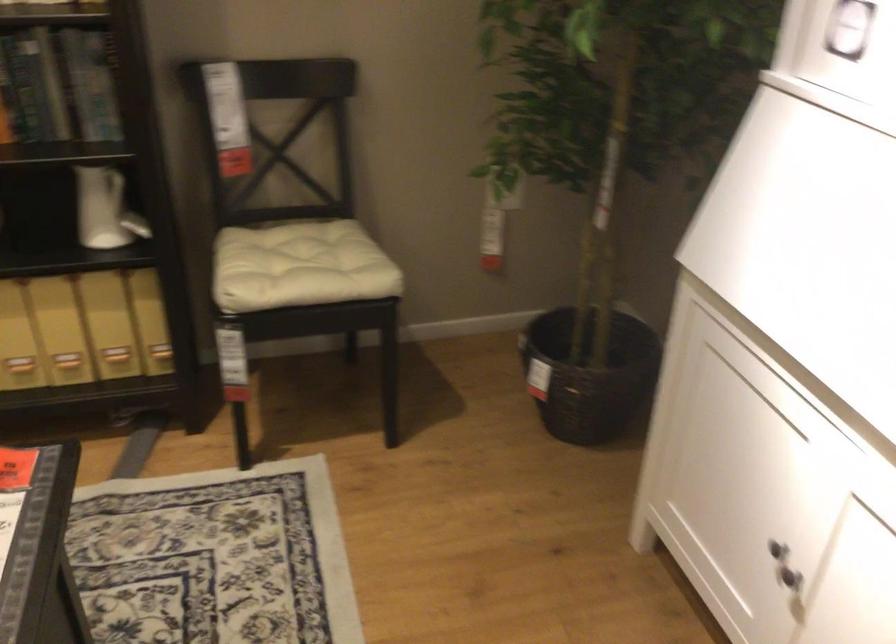
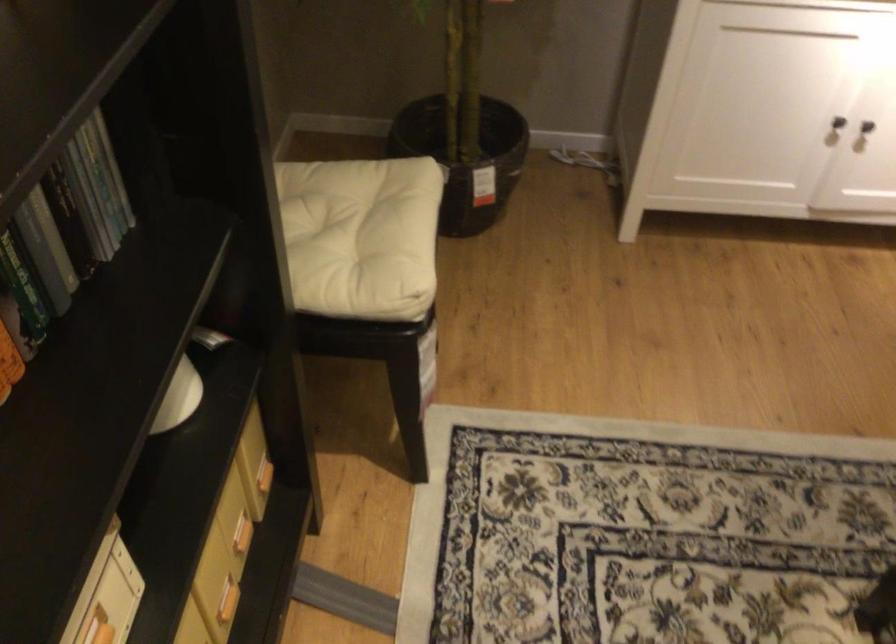
The point at (74, 362) is marked in the first image. Where is the corresponding point in the second image?

(227, 601)